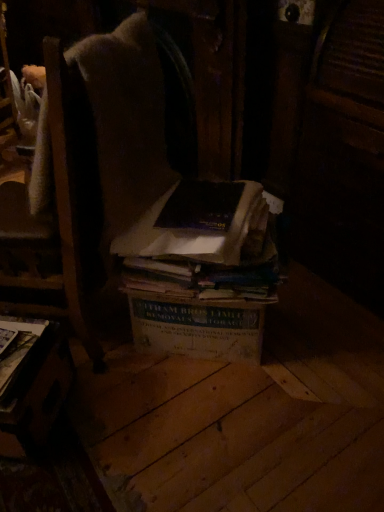
Find the location of a particular element. The height and width of the screenshot is (512, 384). blank space above dark brown paper book at center, the second book when ordered from right to left (from a real-world perspective) is located at coordinates (197, 196).